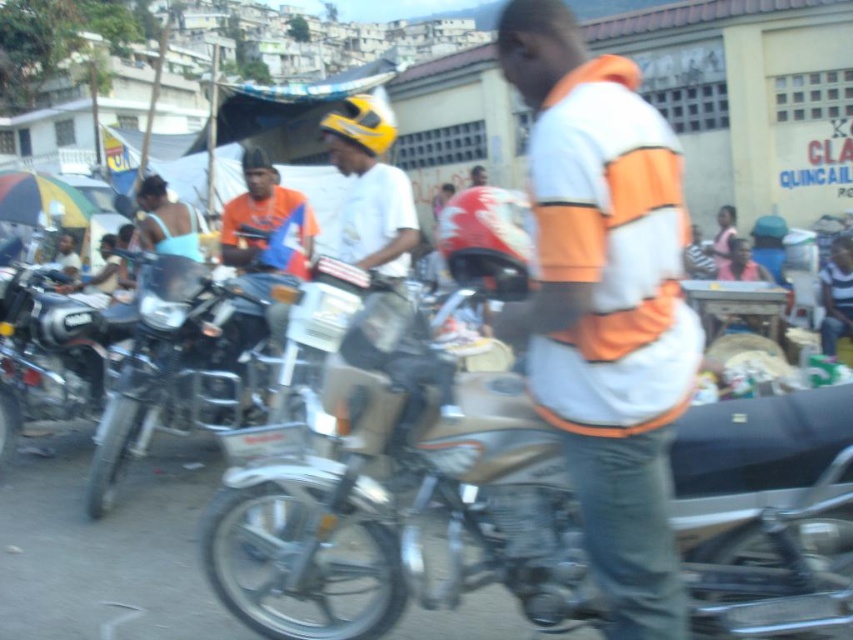
Between metallic silver motorcycle at left and shiny chrome motorcycle at left, which one appears on the left side from the viewer's perspective?

shiny chrome motorcycle at left is more to the left.

Which is above, metallic silver motorcycle at left or shiny chrome motorcycle at left?

shiny chrome motorcycle at left

Find the location of a particular element. This screenshot has width=853, height=640. metallic silver motorcycle at left is located at coordinates (183, 368).

What do you see at coordinates (605, 305) in the screenshot? I see `white-orange jacket at center` at bounding box center [605, 305].

This screenshot has width=853, height=640. In order to click on white-orange jacket at center in this screenshot , I will do `click(605, 305)`.

Which is behind, point (151, 401) or point (395, 308)?

Point (151, 401)

Is metallic silver motorcycle at left above matte white helmet at center?

Incorrect, metallic silver motorcycle at left is not positioned above matte white helmet at center.

What do you see at coordinates (183, 368) in the screenshot? This screenshot has width=853, height=640. I see `metallic silver motorcycle at left` at bounding box center [183, 368].

This screenshot has width=853, height=640. Find the location of `metallic silver motorcycle at left`. metallic silver motorcycle at left is located at coordinates (183, 368).